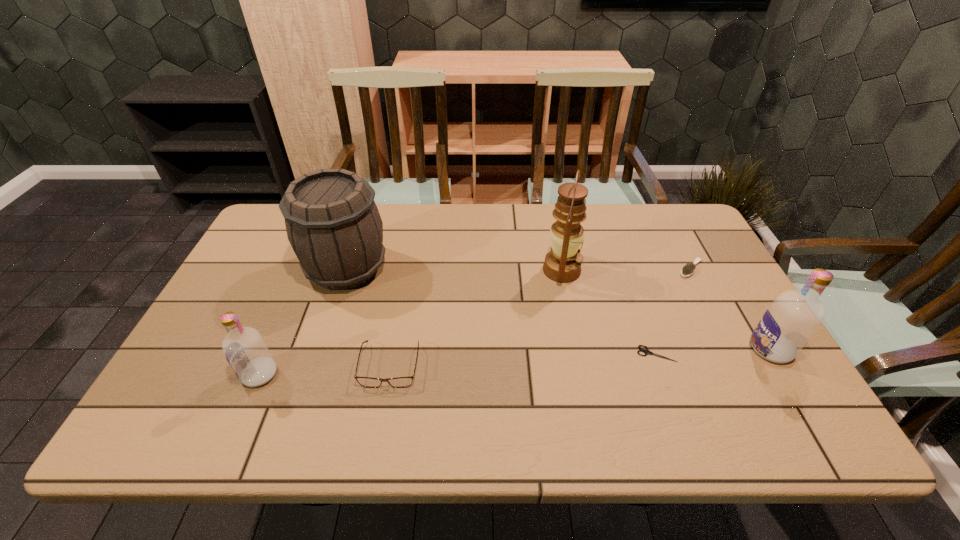
Image resolution: width=960 pixels, height=540 pixels. I want to click on blank area located 0.090m on the label of the left vodka, so click(204, 374).

The image size is (960, 540). What are the coordinates of `vacant region located on the label of the right vodka` in the screenshot? It's located at (689, 349).

Locate an element on the screen. Image resolution: width=960 pixels, height=540 pixels. free spot located on the label of the right vodka is located at coordinates (713, 349).

You are a GUI agent. You are given a task and a screenshot of the screen. Output one action in this format:
    pyautogui.click(x=<x>, y=<y>)
    Task: Click on the free space located 0.160m on the label of the right vodka
    Image resolution: width=960 pixels, height=540 pixels.
    Given the screenshot: What is the action you would take?
    pyautogui.click(x=685, y=349)

Find the location of `free location located 0.070m on the back of the wine bucket`. free location located 0.070m on the back of the wine bucket is located at coordinates coord(359,228).

Identify the location of vacant space situated 0.380m on the left of the sixth tallest object. The image size is (960, 540). (548, 268).

At what (x,y) coordinates should I click in order to perform the action: click on vacant region located 0.260m on the left of the oil lamp. Please return your answer as a coordinate pair (x, y). Looking at the image, I should click on (454, 270).

Find the location of a particular element. vacant space situated on the back of the shears is located at coordinates (618, 248).

Locate an element on the screen. object that is at the far edge is located at coordinates (333, 224).

The height and width of the screenshot is (540, 960). What are the coordinates of `vodka located at the near edge` in the screenshot? It's located at (245, 350).